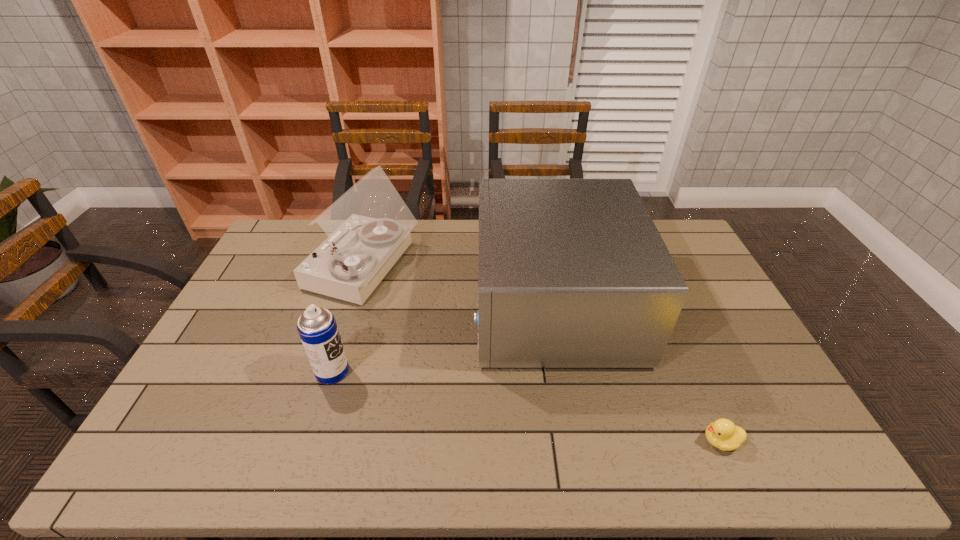
The width and height of the screenshot is (960, 540). Find the location of `free space located 0.140m on the beak of the nearest object`. free space located 0.140m on the beak of the nearest object is located at coordinates (643, 441).

You are a GUI agent. You are given a task and a screenshot of the screen. Output one action in this format:
    pyautogui.click(x=<x>, y=<y>)
    Task: Click on the vacant position located on the beak of the nearest object
    
    Given the screenshot: What is the action you would take?
    pyautogui.click(x=589, y=441)

Identify the location of free region located 0.200m on the beak of the nearest object. (618, 441).

This screenshot has height=540, width=960. Find the location of `record player present at the far edge`. record player present at the far edge is located at coordinates (368, 227).

Locate an element on the screen. microwave oven situated at the far edge is located at coordinates (573, 273).

Image resolution: width=960 pixels, height=540 pixels. I want to click on object present at the near edge, so click(x=722, y=433).

This screenshot has height=540, width=960. Find the location of `object present at the right edge`. object present at the right edge is located at coordinates (722, 433).

The height and width of the screenshot is (540, 960). I want to click on object that is at the near right corner, so click(x=722, y=433).

Where is `vacant space at the far edge`? vacant space at the far edge is located at coordinates (455, 220).

What are the coordinates of `vacant point at the near edge` in the screenshot? It's located at (752, 469).